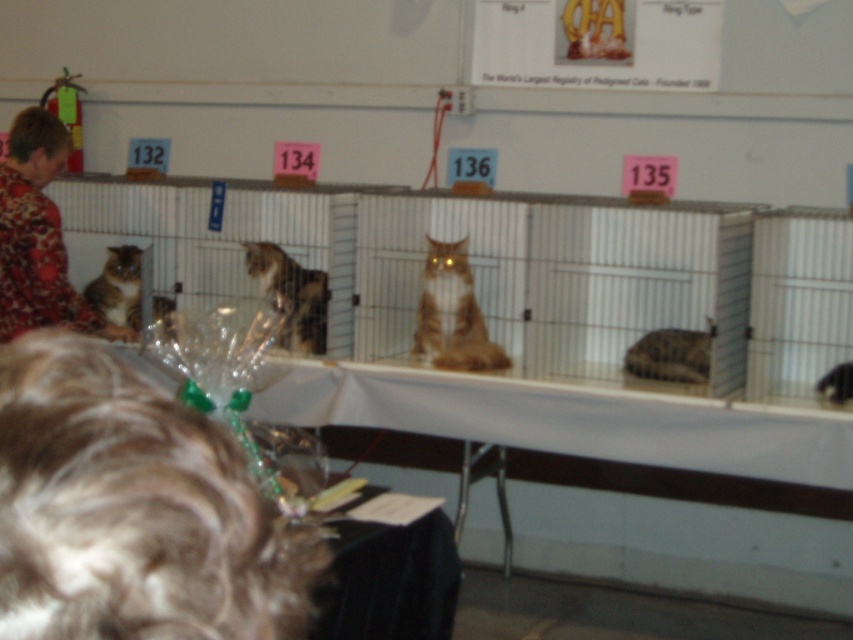
Question: Is fuzzy brown hair at lower left above calico fur cat at center?

Choices:
 (A) no
 (B) yes

Answer: (A)

Question: Can you confirm if floral-patterned shirt at left is positioned below brown fur cat at center?

Choices:
 (A) yes
 (B) no

Answer: (B)

Question: Can you confirm if white plastic table at center is bigger than orange fur cat at center?

Choices:
 (A) no
 (B) yes

Answer: (B)

Question: Which of the following is the farthest from the observer?

Choices:
 (A) (42, 627)
 (B) (280, 304)
 (C) (128, 268)
 (D) (647, 339)

Answer: (C)

Question: Estimate the real-world distances between objects in this image. Which object is farther from the brown fur cat at center?

Choices:
 (A) floral-patterned shirt at left
 (B) orange fur cat at center
 (C) calico fur cat at center
 (D) fuzzy brown hair at lower left

Answer: (D)

Question: Which point appears closest to the camera in this image?

Choices:
 (A) (326, 285)
 (B) (646, 346)

Answer: (B)